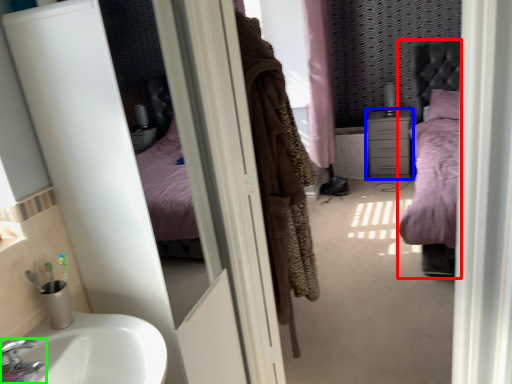
Question: Based on their relative distances, which object is nearer to bed (highlighted by a red box)? Choose from chest of drawers (highlighted by a blue box) and tap (highlighted by a green box).

Choices:
 (A) chest of drawers
 (B) tap

Answer: (A)